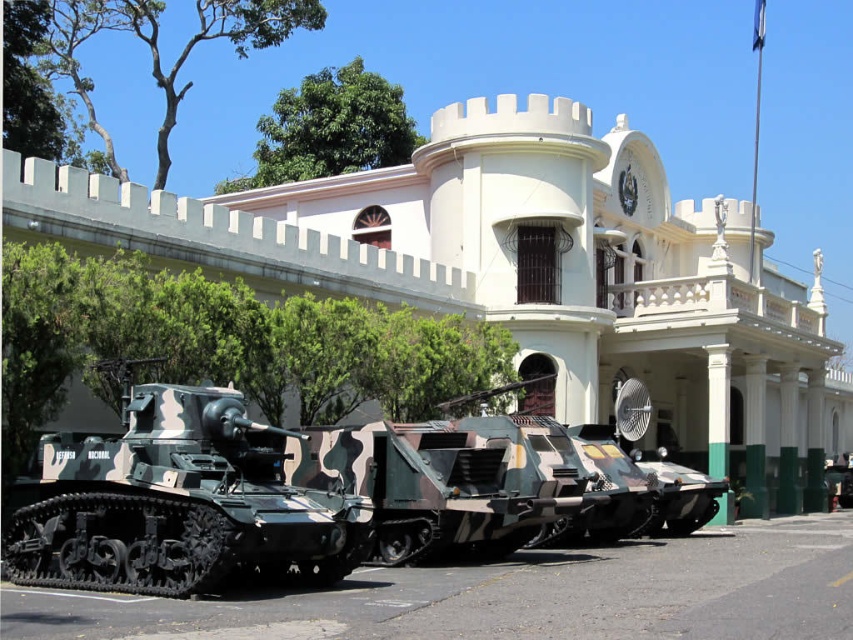
Question: Where is camo-textured tank at center located in relation to camouflage-patterned tank at center in the image?

Choices:
 (A) left
 (B) right

Answer: (A)

Question: Is white smooth building at center wider than camouflage-patterned tank at center?

Choices:
 (A) yes
 (B) no

Answer: (A)

Question: Does white smooth building at center come behind camouflage-patterned tank at center?

Choices:
 (A) no
 (B) yes

Answer: (B)

Question: Which point appears farthest from the camera in this image?

Choices:
 (A) (830, 356)
 (B) (561, 497)

Answer: (A)

Question: Among these objects, which one is nearest to the camera?

Choices:
 (A) camouflage-patterned tank at center
 (B) white smooth building at center

Answer: (A)

Question: Among these points, which one is farthest from the camera?

Choices:
 (A) (440, 134)
 (B) (434, 481)

Answer: (A)